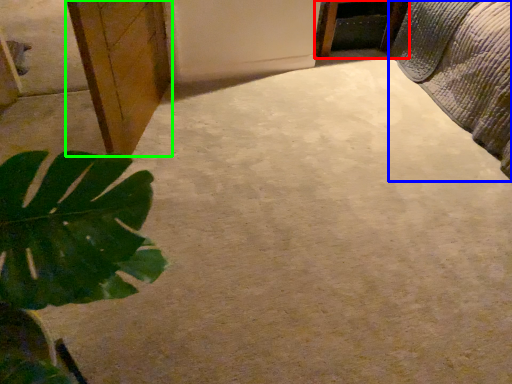
Question: Considering the real-world distances, which object is farthest from furniture (highlighted by a red box)? bed (highlighted by a blue box) or cabinetry (highlighted by a green box)?

Choices:
 (A) bed
 (B) cabinetry

Answer: (B)